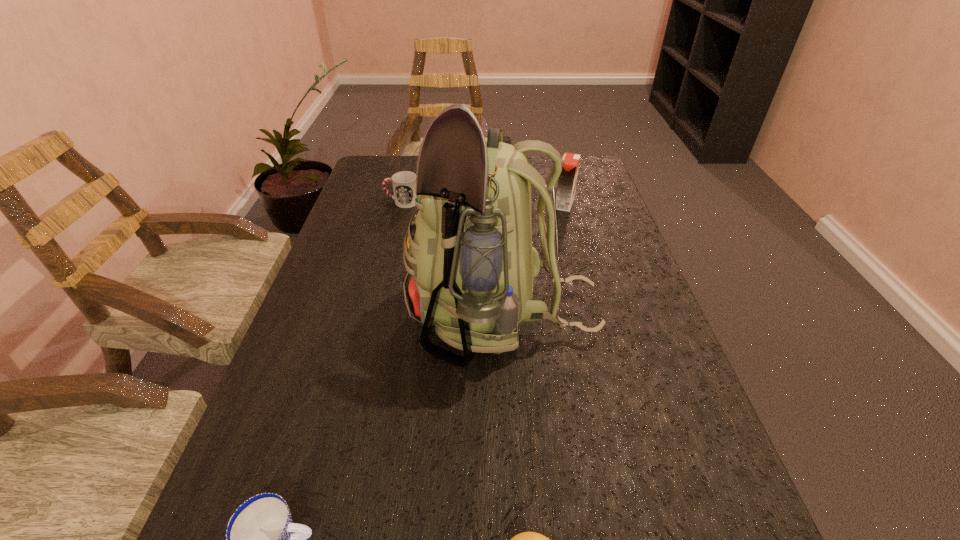
Where is `backpack`? The image size is (960, 540). backpack is located at coordinates (472, 265).

Find the location of a particular element. the third farthest object is located at coordinates (472, 265).

This screenshot has width=960, height=540. Find the location of `orange juice`. orange juice is located at coordinates (566, 185).

Find the location of `the farther cup`. the farther cup is located at coordinates (404, 183).

Find the location of a particular element. vacant space positioned on the front-facing side of the backpack is located at coordinates (325, 317).

You are a GUI agent. You are given a task and a screenshot of the screen. Output one action in this format:
    pyautogui.click(x=<x>, y=<y>)
    Task: Click on the free region located on the front of the second tallest object
    This screenshot has width=960, height=540.
    Given the screenshot: What is the action you would take?
    pyautogui.click(x=584, y=276)

You are a GUI agent. You are given a task and a screenshot of the screen. Output one action in this format:
    pyautogui.click(x=<x>, y=<y>)
    Task: Click on the object that is positioned at the left edge
    The height and width of the screenshot is (540, 960).
    Given the screenshot: What is the action you would take?
    pyautogui.click(x=404, y=183)

You are a GUI agent. You are given a task and a screenshot of the screen. Output one action in this format:
    pyautogui.click(x=<x>, y=<y>)
    Task: Click on the backpack at the right edge
    The width and height of the screenshot is (960, 540).
    Given the screenshot: What is the action you would take?
    pyautogui.click(x=472, y=265)

This screenshot has width=960, height=540. In order to click on orange juice that is at the right edge in this screenshot , I will do `click(566, 185)`.

In the image, there is a desktop. At what (x,y) coordinates should I click in order to perform the action: click on vacant space at the left edge. Please return your answer as a coordinate pair (x, y). The width and height of the screenshot is (960, 540). Looking at the image, I should click on (243, 497).